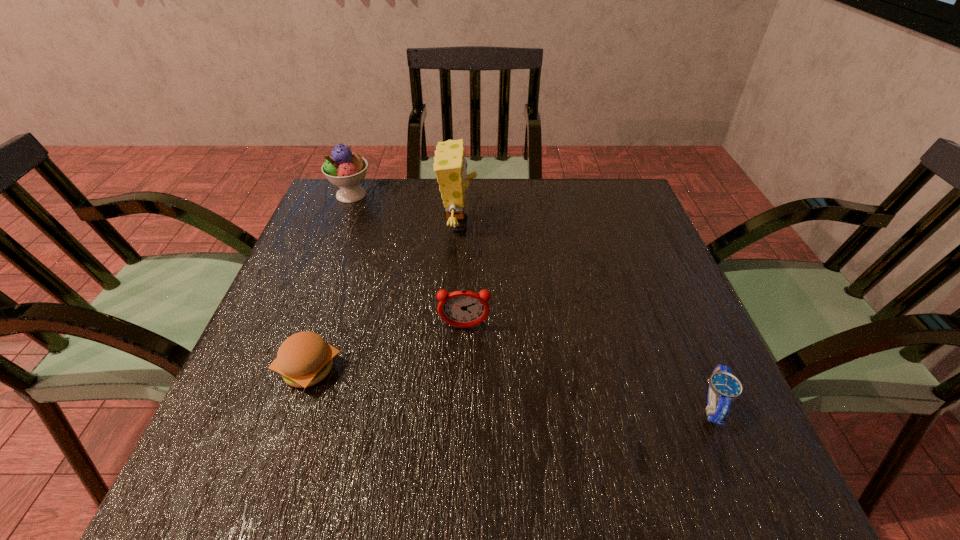
Where is `the tallest object`? the tallest object is located at coordinates (450, 165).

The image size is (960, 540). In order to click on icecream in this screenshot , I will do `click(344, 169)`.

You are a GUI agent. You are given a task and a screenshot of the screen. Output one action in this format:
    pyautogui.click(x=<x>, y=<y>)
    Task: Click on the alarm clock
    This screenshot has width=960, height=540.
    Given the screenshot: What is the action you would take?
    pyautogui.click(x=462, y=308)

Find the location of a particular element. the third tallest object is located at coordinates [462, 308].

I want to click on hamburger, so pyautogui.click(x=304, y=359).

Locate an element on the screen. The image size is (960, 540). the shortest object is located at coordinates (724, 388).

Locate an element on the screen. This screenshot has width=960, height=540. watch is located at coordinates (724, 388).

The height and width of the screenshot is (540, 960). What are the coordinates of `free spot located 0.120m on the face of the tallest object` in the screenshot? It's located at (523, 226).

This screenshot has width=960, height=540. I want to click on free spot located 0.170m on the front of the icecream, so click(x=331, y=245).

Where is `vacant space located on the front-facing side of the alarm clock`? vacant space located on the front-facing side of the alarm clock is located at coordinates (463, 377).